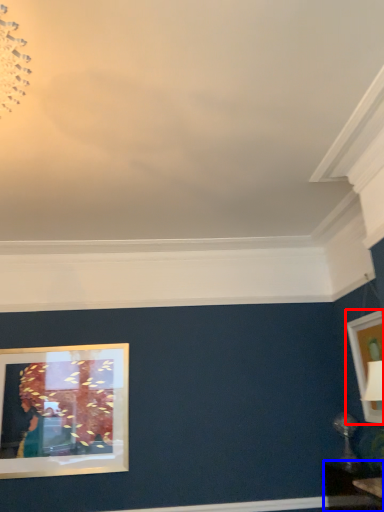
Question: Which point is closer to the camera, picture frame (highlighted by a red box) or table (highlighted by a blue box)?

Choices:
 (A) picture frame
 (B) table

Answer: (B)